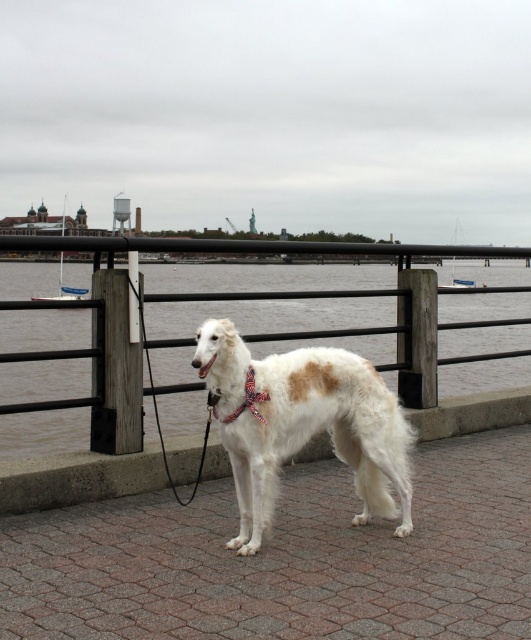
You are standing at the edge of the waterfront promenade and want to walk to the white brick pavement at center. According to the coordinates provided, in which direction should you move relative to your current position?

The white brick pavement at center is located at coordinates point (x=286, y=557). Since the x and y coordinates are both greater than 0.5, you should move forward and to the right to reach it.

You are standing on the waterfront promenade and want to walk from the dog to the distant boat. Which point should you step on first, point (244, 627) or point (261, 392)?

You should step on point (244, 627) first because it is closer to the viewer than point (261, 392), so it is on the path towards the distant boat.

You are standing on the white brick pavement at center. What are the coordinates of the point where you are standing?

The coordinates of the white brick pavement at center are at point (x=286, y=557).